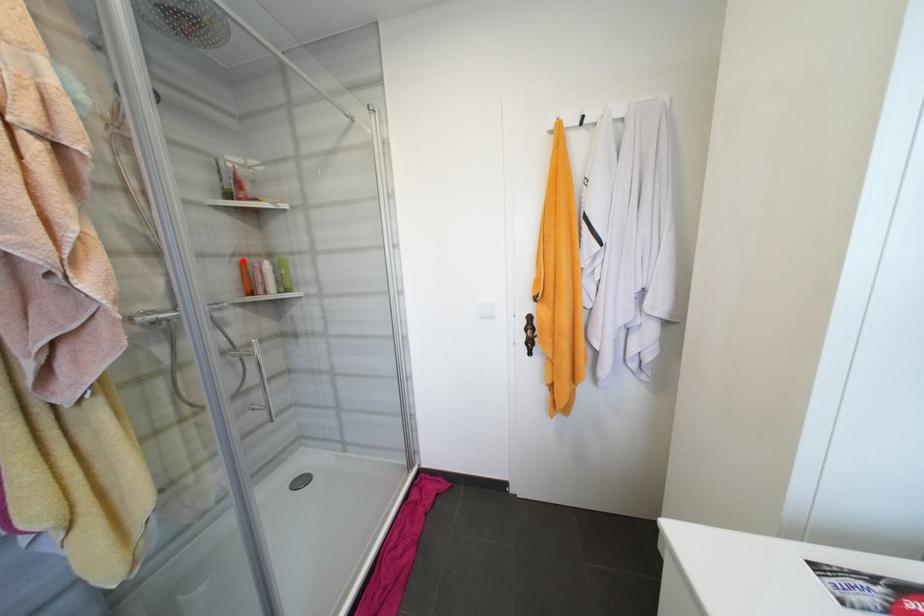
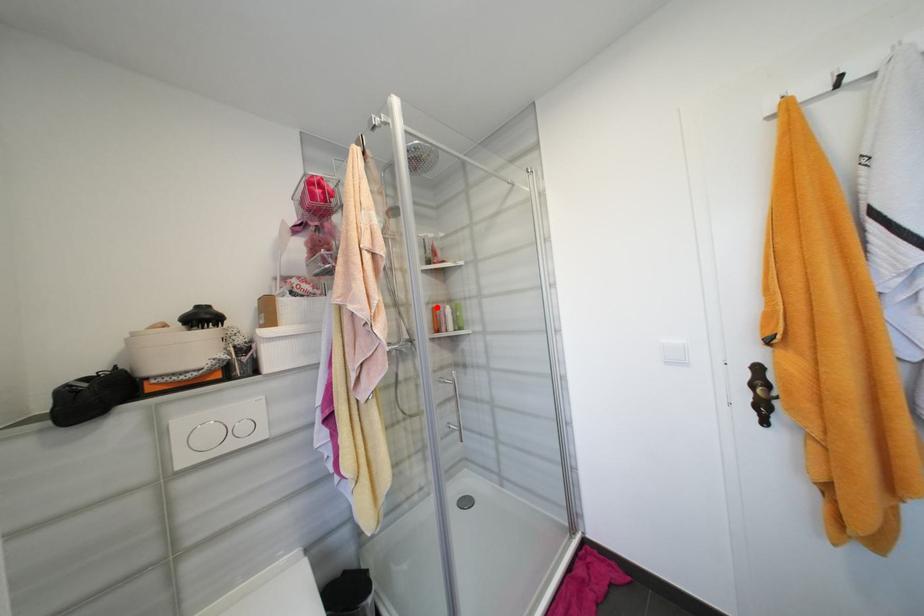
I am providing you with two images of the same scene from different viewpoints. A red point is marked on the first image and another point is marked on the second image. Is the red point in image1 aligned with the point shown in image2?

Yes